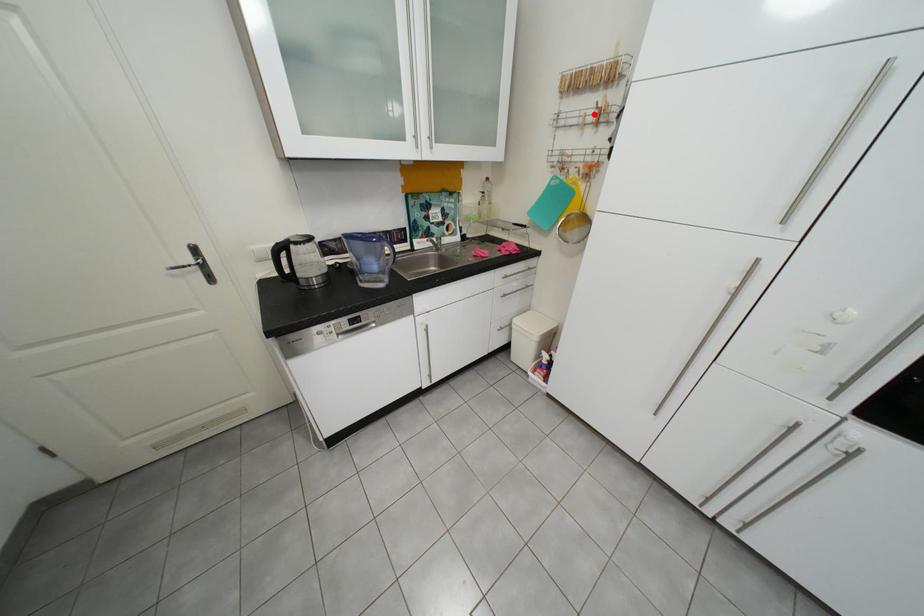
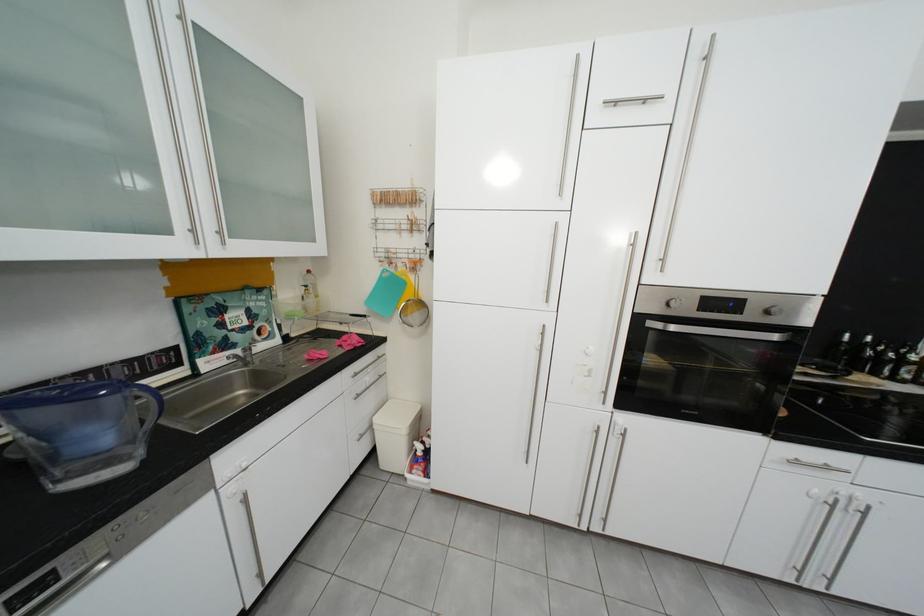
Find the pixel in the second image that matches the highlighted location in the first image.

(408, 223)